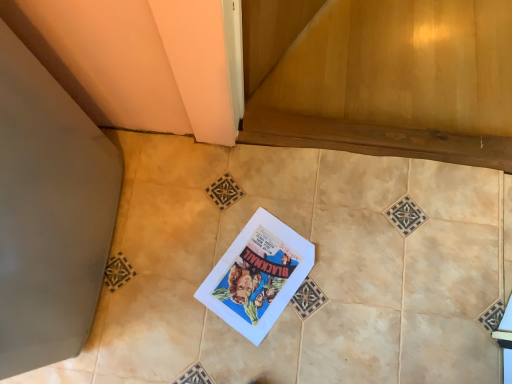
Question: Is wooden at lower center wider or thinner than matte paper comic book at center?

Choices:
 (A) wide
 (B) thin

Answer: (A)

Question: From the image's perspective, relative to matte paper comic book at center, is wooden at lower center above or below?

Choices:
 (A) below
 (B) above

Answer: (B)

Question: Which of these objects is positioned closest to the matte paper comic book at center?

Choices:
 (A) wooden at lower center
 (B) beige ceramic tile at center

Answer: (B)

Question: Estimate the real-world distances between objects in this image. Which object is closer to the beige ceramic tile at center?

Choices:
 (A) matte paper comic book at center
 (B) wooden at lower center

Answer: (A)